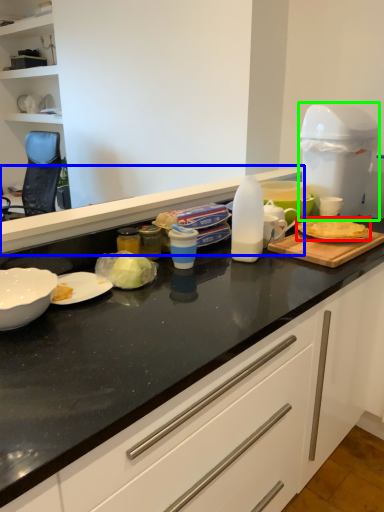
Question: Considering the real-world distances, which object is closest to food (highlighted by a red box)? countertop (highlighted by a blue box) or appliance (highlighted by a green box).

Choices:
 (A) countertop
 (B) appliance

Answer: (B)